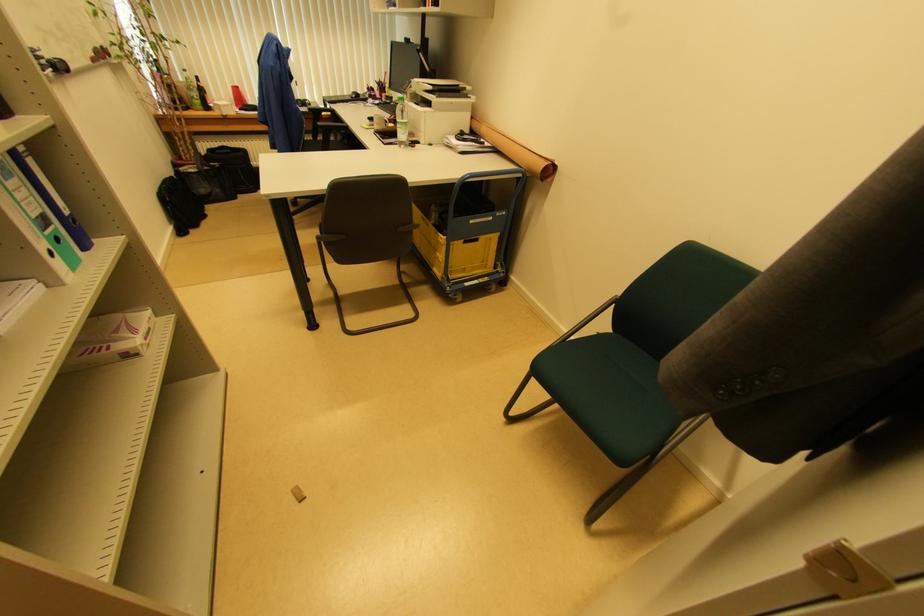
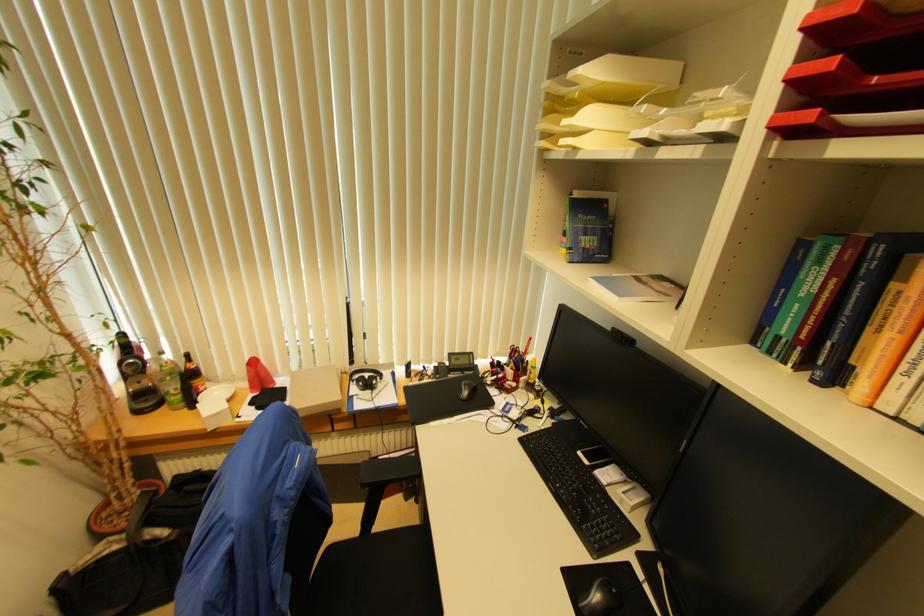
Locate, in the second image, the point that corresponds to point 199,79 in the first image.

(188, 358)